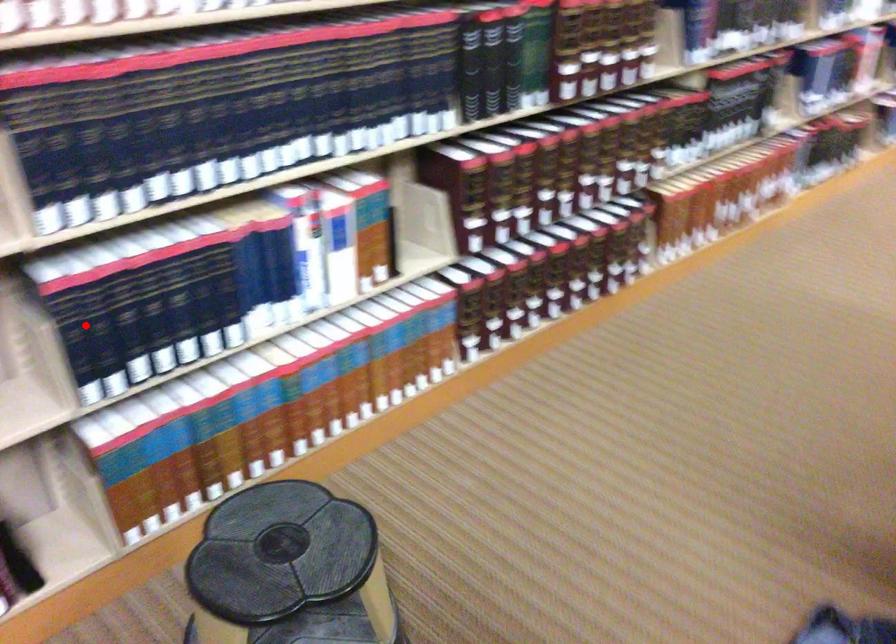
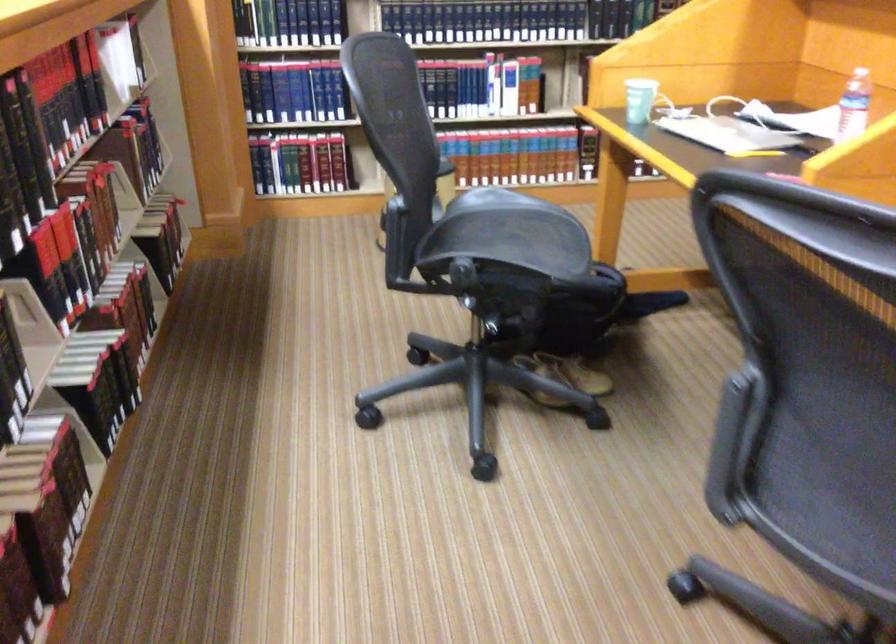
Question: I am providing you with two images of the same scene from different viewpoints. A red point is marked on the first image. Can you still see the location of the red point in image 2?

Choices:
 (A) Yes
 (B) No

Answer: (B)